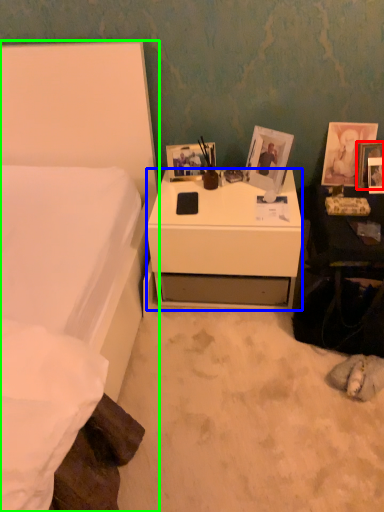
Question: Which is nearer to the picture frame (highlighted by a red box)? desk (highlighted by a blue box) or bed (highlighted by a green box).

Choices:
 (A) desk
 (B) bed

Answer: (A)